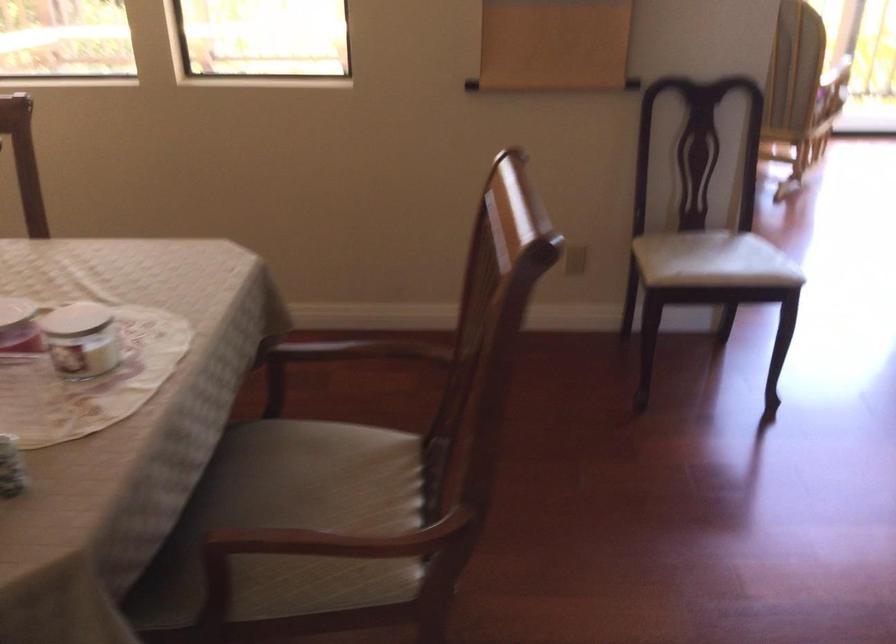
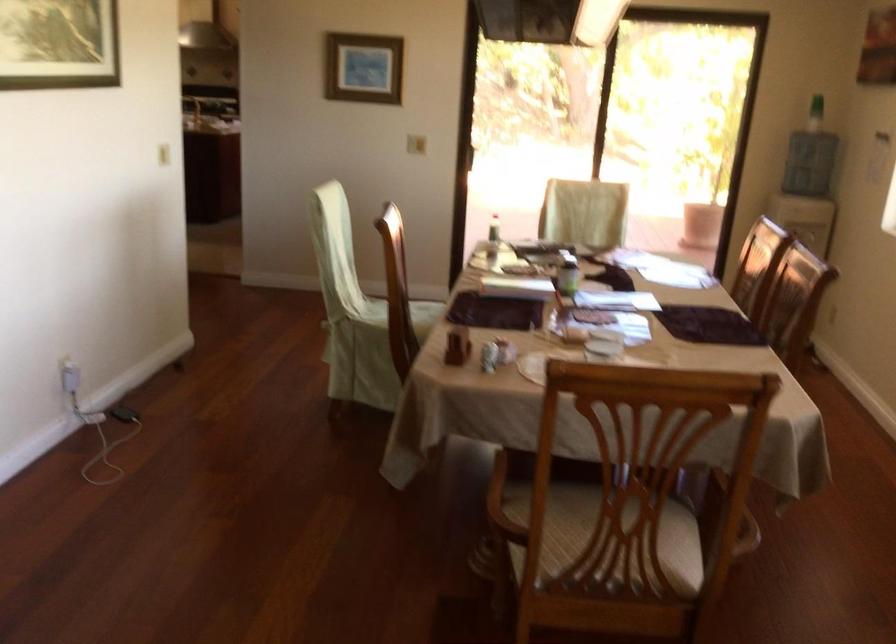
Where in the second image is the point corresponding to the point at 285,458 from the first image?

(631, 513)